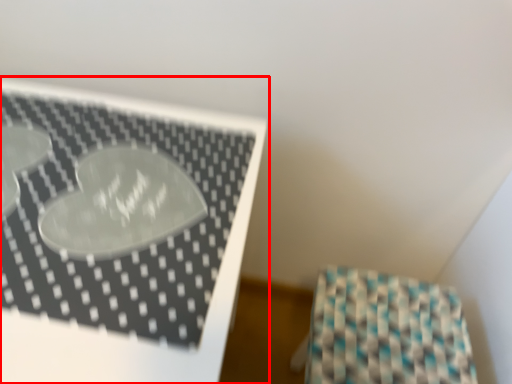
Question: Considering the relative positions of furniture (annotated by the red box) and wrapping paper in the image provided, where is furniture (annotated by the red box) located with respect to the staircase?

Choices:
 (A) right
 (B) left

Answer: (B)